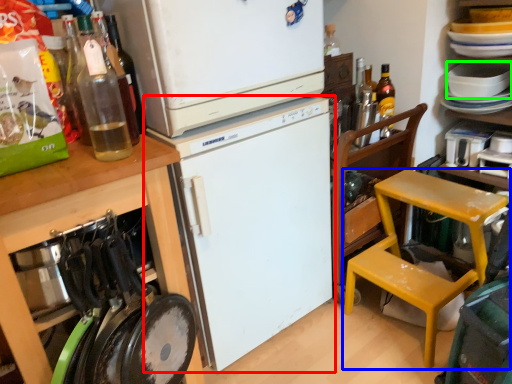
Question: Which object is the farthest from refrigerator (highlighted by a red box)? Choose among these: chair (highlighted by a blue box) or appliance (highlighted by a green box).

Choices:
 (A) chair
 (B) appliance

Answer: (B)